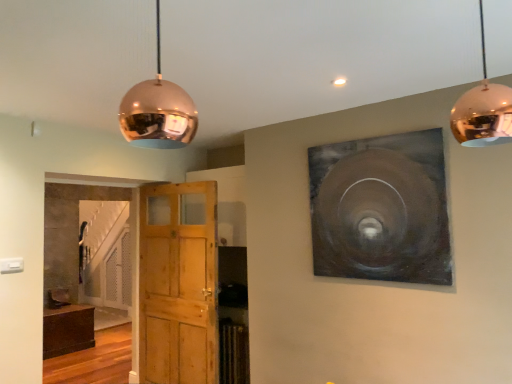
Question: From the image's perspective, is wooden door at center located beneath copper reflective sphere at upper left, the first lamp viewed from the left?

Choices:
 (A) yes
 (B) no

Answer: (A)

Question: Is wooden door at center shorter than copper reflective sphere at upper left, the first lamp viewed from the left?

Choices:
 (A) yes
 (B) no

Answer: (B)

Question: Does wooden door at center have a smaller size compared to copper reflective sphere at upper left, the first lamp viewed from the left?

Choices:
 (A) yes
 (B) no

Answer: (B)

Question: Considering the relative positions of wooden door at center and copper reflective sphere at upper left, the second lamp viewed from the right, in the image provided, is wooden door at center behind copper reflective sphere at upper left, the second lamp viewed from the right,?

Choices:
 (A) no
 (B) yes

Answer: (B)

Question: Is wooden door at center wider than copper reflective sphere at upper left, the second lamp viewed from the right?

Choices:
 (A) no
 (B) yes

Answer: (A)

Question: Do you think wooden door at center is within copper reflective sphere at upper right, the 2th lamp in the left-to-right sequence, or outside of it?

Choices:
 (A) inside
 (B) outside

Answer: (B)

Question: From a real-world perspective, is wooden door at center physically located above or below copper reflective sphere at upper right, which is the first lamp in right-to-left order?

Choices:
 (A) below
 (B) above

Answer: (A)

Question: Considering the positions of point (209, 317) and point (481, 94), is point (209, 317) closer or farther from the camera than point (481, 94)?

Choices:
 (A) farther
 (B) closer

Answer: (A)

Question: Looking at the image, does wooden door at center seem bigger or smaller compared to copper reflective sphere at upper right, the 2th lamp in the left-to-right sequence?

Choices:
 (A) small
 (B) big

Answer: (B)

Question: From the image's perspective, is wooden door at center located above or below copper reflective sphere at upper left, the first lamp viewed from the left?

Choices:
 (A) above
 (B) below

Answer: (B)

Question: In terms of width, does wooden door at center look wider or thinner when compared to copper reflective sphere at upper left, the first lamp viewed from the left?

Choices:
 (A) wide
 (B) thin

Answer: (B)

Question: From a real-world perspective, is wooden door at center above or below copper reflective sphere at upper left, the first lamp viewed from the left?

Choices:
 (A) above
 (B) below

Answer: (B)

Question: Is wooden door at center in front of or behind copper reflective sphere at upper left, the second lamp viewed from the right, in the image?

Choices:
 (A) front
 (B) behind

Answer: (B)

Question: From the image's perspective, is dark wood cabinet at lower left above or below wooden door at center?

Choices:
 (A) below
 (B) above

Answer: (A)

Question: Is dark wood cabinet at lower left taller or shorter than wooden door at center?

Choices:
 (A) short
 (B) tall

Answer: (A)